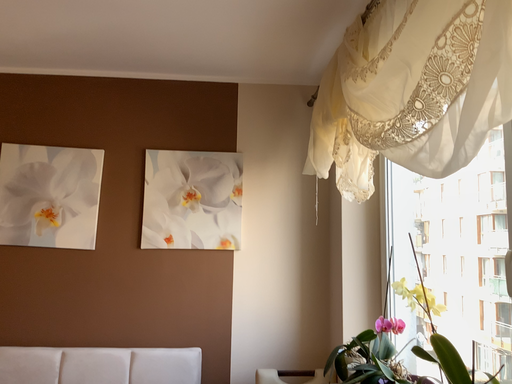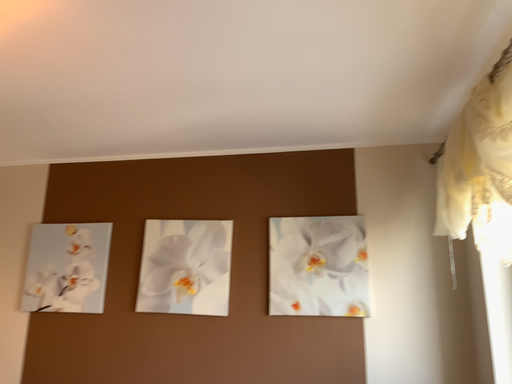
Question: How did the camera likely rotate when shooting the video?

Choices:
 (A) rotated downward
 (B) rotated upward

Answer: (B)